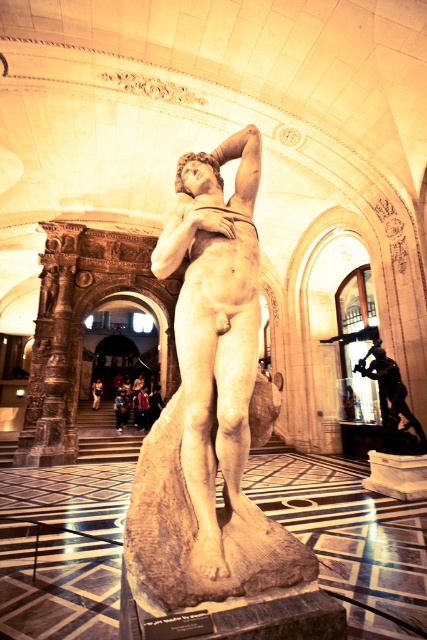
You are an art conservator tasked with moving the statues from the gallery. You have a transport vehicle that can only accommodate items up to 1.8 meters in width. Given that the white marble statue at center and the shiny bronze statue at center are both at the center, can you determine which statue you can safely transport without exceeding the width limit?

The white marble statue at center might be wider than the shiny bronze statue at center, so it is uncertain whether it will fit within the 1.8 meters width limit. The shiny bronze statue at center is narrower, so it can be safely transported.

You are standing in the grand museum and want to locate the white marble statue at center. According to the coordinates provided, where exactly would you find it?

The white marble statue at center is located at point coordinates of (210, 404).